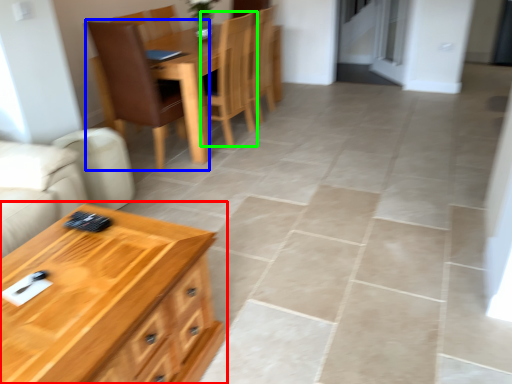
Question: Based on their relative distances, which object is farther from table (highlighted by a red box)? Choose from chair (highlighted by a blue box) and chair (highlighted by a green box).

Choices:
 (A) chair
 (B) chair

Answer: (B)